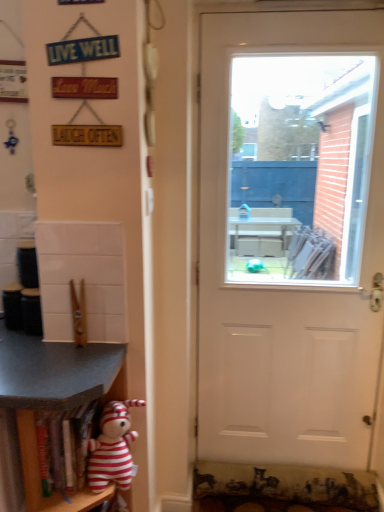
Image resolution: width=384 pixels, height=512 pixels. In order to click on blank space above white matte door at center (from a real-world perspective) in this screenshot , I will do `click(316, 7)`.